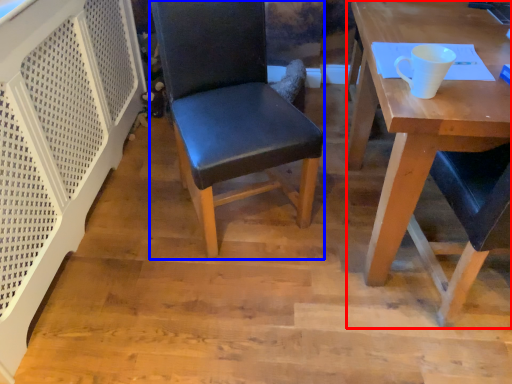
Question: Which of the following is the farthest to the observer, desk (highlighted by a red box) or chair (highlighted by a blue box)?

Choices:
 (A) desk
 (B) chair

Answer: (B)